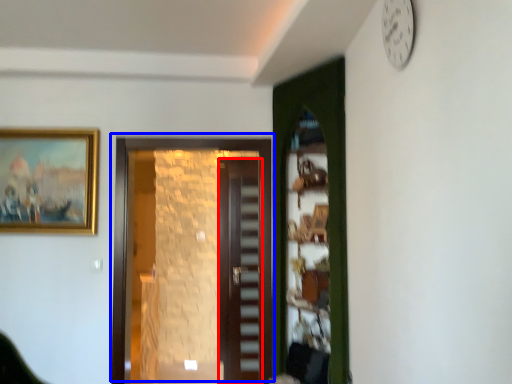
Question: Which object appears farthest to the camera in this image, door (highlighted by a red box) or door (highlighted by a blue box)?

Choices:
 (A) door
 (B) door

Answer: (A)